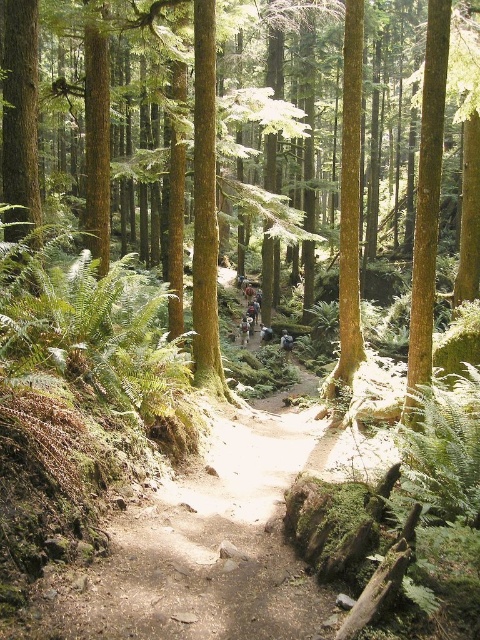
Question: Does green leafy fern at left appear under green rough bark tree at center?

Choices:
 (A) no
 (B) yes

Answer: (B)

Question: In this image, where is green matte tree at center located relative to green rough bark tree at center?

Choices:
 (A) left
 (B) right

Answer: (A)

Question: Among these objects, which one is nearest to the camera?

Choices:
 (A) smooth brown tree trunk at center
 (B) green rough bark tree at center
 (C) green leafy fern at left
 (D) green matte tree at center

Answer: (C)

Question: Which object appears closest to the camera in this image?

Choices:
 (A) green leafy fern at left
 (B) green matte tree at center

Answer: (A)

Question: Is green matte tree at center above green rough bark tree at center?

Choices:
 (A) no
 (B) yes

Answer: (B)

Question: Which of these objects is positioned farthest from the smooth brown tree trunk at center?

Choices:
 (A) green leafy fern at left
 (B) green matte tree at center

Answer: (A)